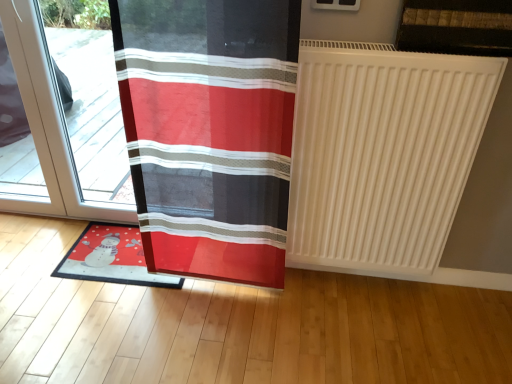
In order to click on free point above matte plastic mat at lower left (from a real-world perspective) in this screenshot , I will do `click(116, 252)`.